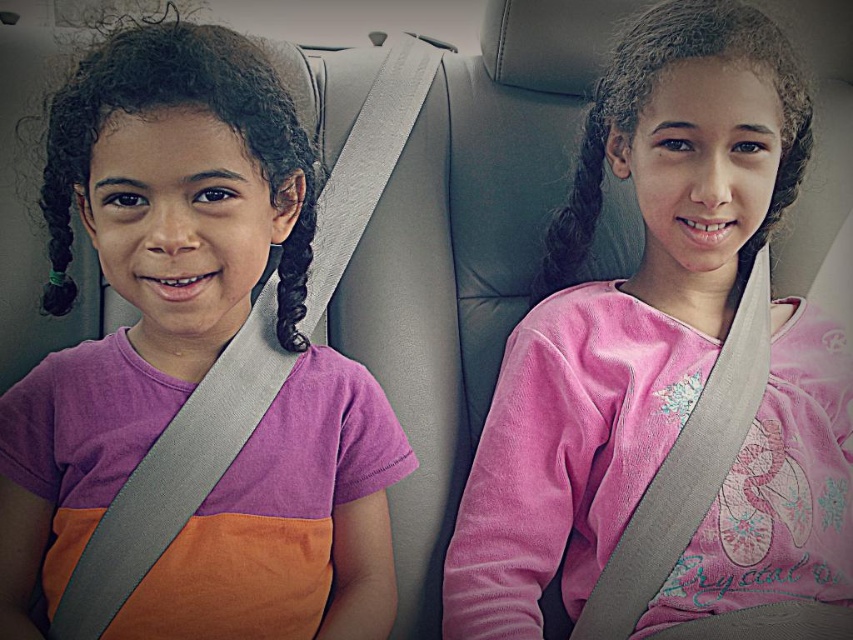
Consider the image. Which is more to the left, matte purple shirt at left or pink velvety shirt at center?

matte purple shirt at left is more to the left.

Does point (260, 547) come closer to viewer compared to point (833, 563)?

Yes, it is.

This screenshot has width=853, height=640. In order to click on matte purple shirt at left in this screenshot , I will do `click(195, 356)`.